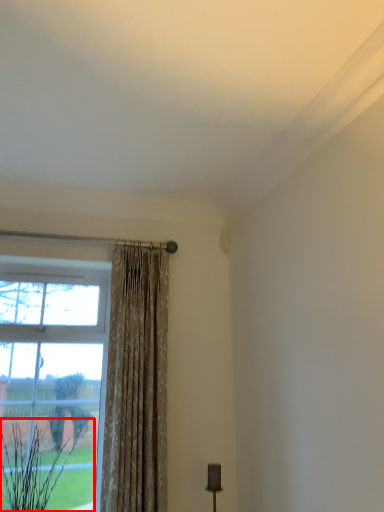
Question: From the image's perspective, considering the relative positions of plant (annotated by the red box) and curtain in the image provided, where is plant (annotated by the red box) located with respect to the staircase?

Choices:
 (A) above
 (B) below

Answer: (B)